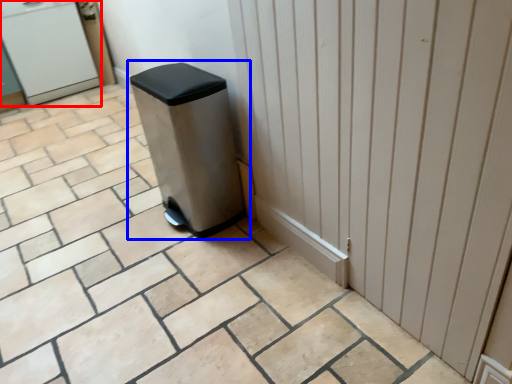
Question: Which of the following is the closest to the observer, water cooler (highlighted by a red box) or waste container (highlighted by a blue box)?

Choices:
 (A) water cooler
 (B) waste container

Answer: (B)